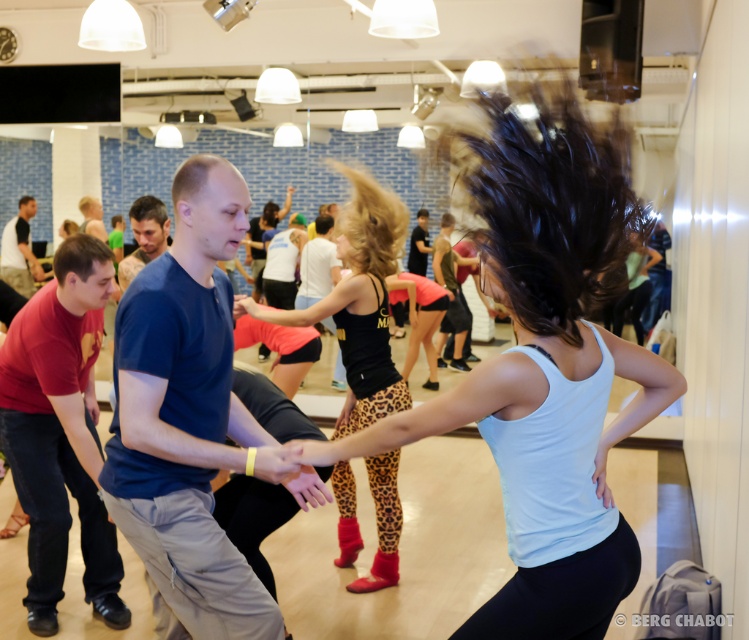
You are a photographer setting up for a dance class photo shoot. You need to ensure that the white matte tank top at center and the leopard print leggings at center are both visible in your shot. Based on their sizes, which one might require you to adjust your camera angle to avoid being too small in the frame?

The white matte tank top at center is not as tall as leopard print leggings at center, so the white matte tank top at center might require adjusting the camera angle to avoid appearing too small in the frame.

You are a photographer in the dance studio and want to capture a closeup of the two dancers. Since your camera can only focus on one object at a time, which object between the white matte tank top at center and the leopard print leggings at center should you choose to ensure the wider one is in focus?

The white matte tank top at center has a larger width than the leopard print leggings at center, so you should focus on the white matte tank top at center to ensure the wider object is in focus.

You are a photographer positioned at the entrance of the dance studio. You need to capture a photo of the white matte tank top at center. According to the scene description, where should you aim your camera to ensure the tank top is centered in the photo?

The white matte tank top at center is located at point (545, 362), so you should aim your camera at those coordinates to center it in the photo.